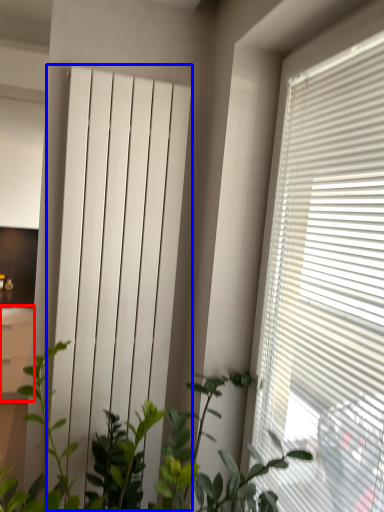
Question: Among these objects, which one is farthest to the camera, file cabinet (highlighted by a red box) or curtain (highlighted by a blue box)?

Choices:
 (A) file cabinet
 (B) curtain

Answer: (A)